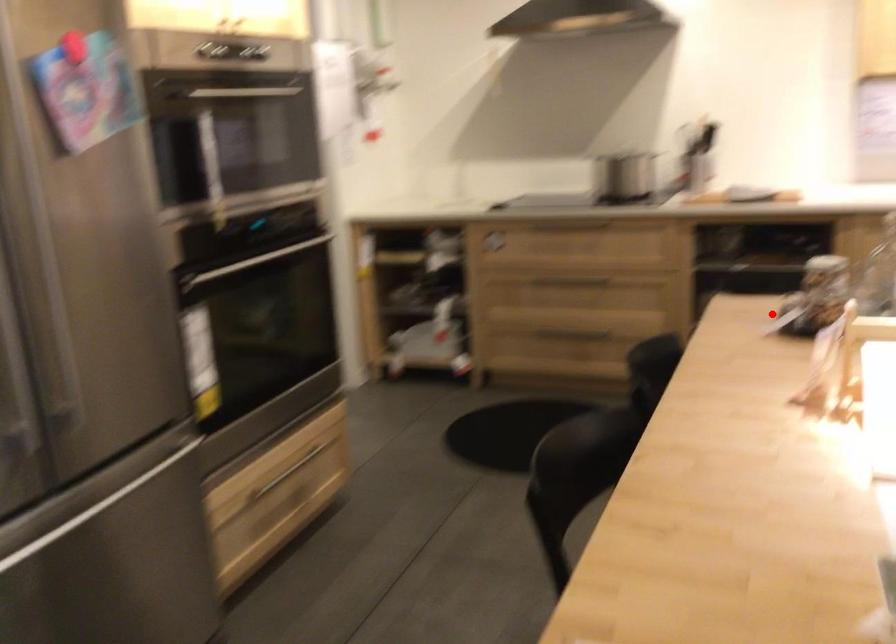
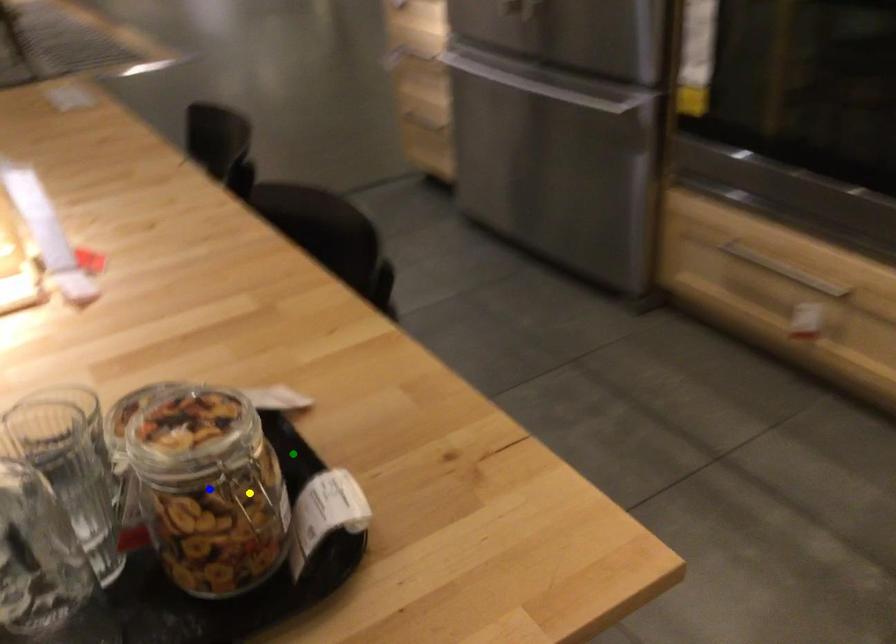
Question: I am providing you with two images of the same scene from different viewpoints. A red point is marked on the first image. You are given multiple points on the second image. Which point in image 2 is actually the same real-world point as the red point in image 1?

Choices:
 (A) yellow point
 (B) green point
 (C) blue point

Answer: (B)